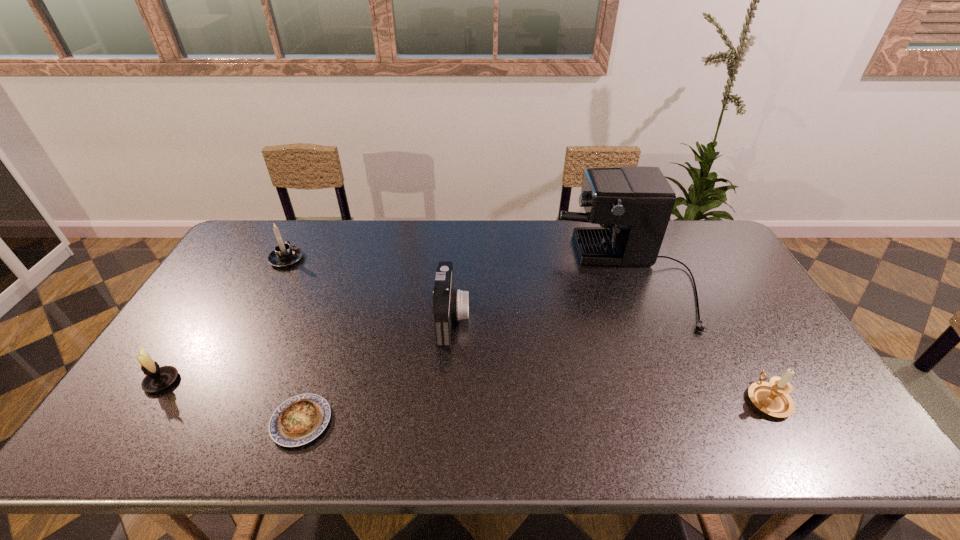
This screenshot has width=960, height=540. Identify the location of vacant space that is in between the rightmost candle holder and the shortest object. (534, 410).

Locate an element on the screen. Image resolution: width=960 pixels, height=540 pixels. vacant area that lies between the second candle holder from right to left and the leftmost candle holder is located at coordinates (224, 320).

Locate an element on the screen. free space that is in between the second object from left to right and the rightmost candle holder is located at coordinates (527, 329).

Identify the location of the third closest object to the second candle holder from left to right. The width and height of the screenshot is (960, 540). (297, 421).

The height and width of the screenshot is (540, 960). Identify the location of object that is the third closest to the shortest object. (x=284, y=255).

Locate which candle holder is the second closest to the quiche. Please provide its 2D coordinates. Your answer should be formatted as a tuple, i.e. [(x, y)], where the tuple contains the x and y coordinates of a point satisfying the conditions above.

[(284, 255)]

Locate which candle holder ranks in proximity to the leftmost object. Please provide its 2D coordinates. Your answer should be formatted as a tuple, i.e. [(x, y)], where the tuple contains the x and y coordinates of a point satisfying the conditions above.

[(284, 255)]

This screenshot has width=960, height=540. I want to click on vacant area in the image that satisfies the following two spatial constraints: 1. with a handle on the side of the rightmost candle holder; 2. on the lens of the camcorder, so click(721, 318).

Find the location of a particular element. blank space that satisfies the following two spatial constraints: 1. on the lens of the fourth object from left to right; 2. with a handle on the side of the rightmost candle holder is located at coordinates point(446,399).

Locate an element on the screen. free location that satisfies the following two spatial constraints: 1. on the front-facing side of the tallest object; 2. with a handle on the side of the rightmost candle holder is located at coordinates (674, 399).